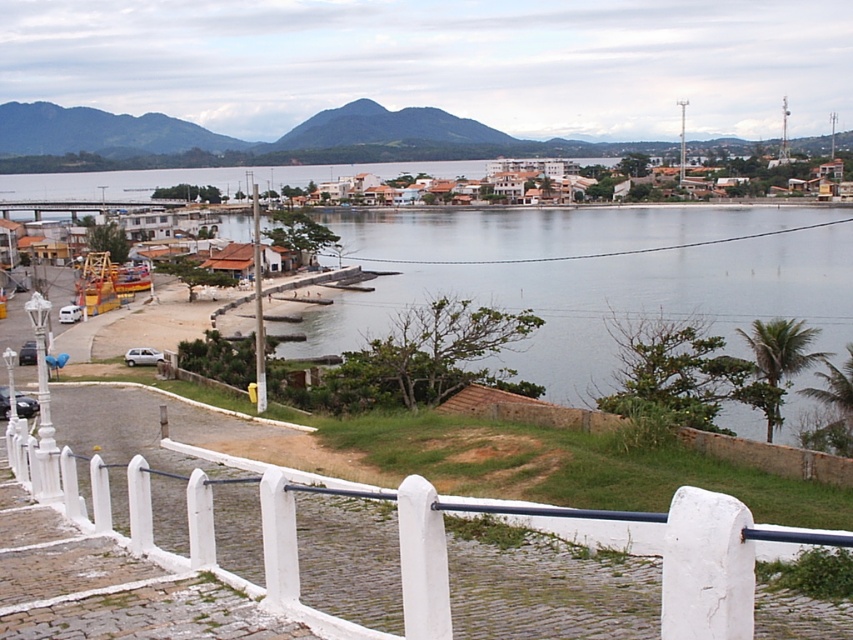
Is point (650, 230) positioned behind point (749, 608)?

Yes.

You are a GUI agent. You are given a task and a screenshot of the screen. Output one action in this format:
    pyautogui.click(x=<x>, y=<y>)
    Task: Click on the clear water at center
    The height and width of the screenshot is (640, 853).
    Given the screenshot: What is the action you would take?
    pyautogui.click(x=592, y=276)

Is white painted wood fence at lower center behind white textured buildings at center?

→ No, it is in front of white textured buildings at center.

Can you confirm if white painted wood fence at lower center is bigger than white textured buildings at center?

No, white painted wood fence at lower center is not bigger than white textured buildings at center.

Is point (422, 632) farther from camera compared to point (314, 196)?

That is False.

Identify the location of white painted wood fence at lower center. (415, 538).

Consider the image. Does clear water at center have a lesser width compared to white textured buildings at center?

Yes.

Measure the distance from clear water at center to white textured buildings at center.

135.63 feet

What do you see at coordinates (592, 276) in the screenshot? I see `clear water at center` at bounding box center [592, 276].

The height and width of the screenshot is (640, 853). Find the location of `clear water at center`. clear water at center is located at coordinates (592, 276).